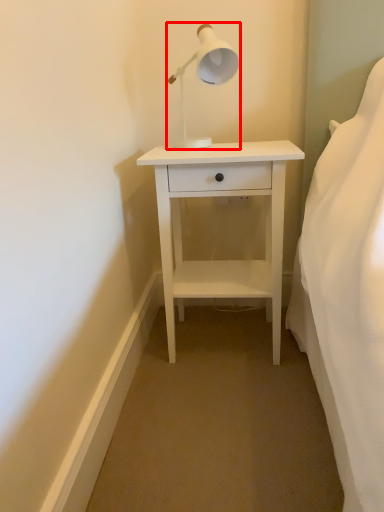
Question: From the image's perspective, where is lamp (annotated by the red box) located relative to nightstand?

Choices:
 (A) above
 (B) below

Answer: (A)